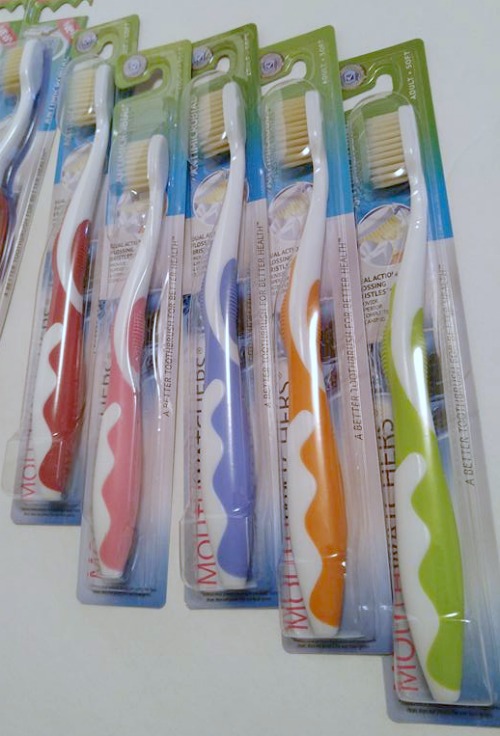
Identify the location of toothbrush handle. (61, 353), (3, 208), (124, 486), (230, 473), (300, 498), (406, 531).